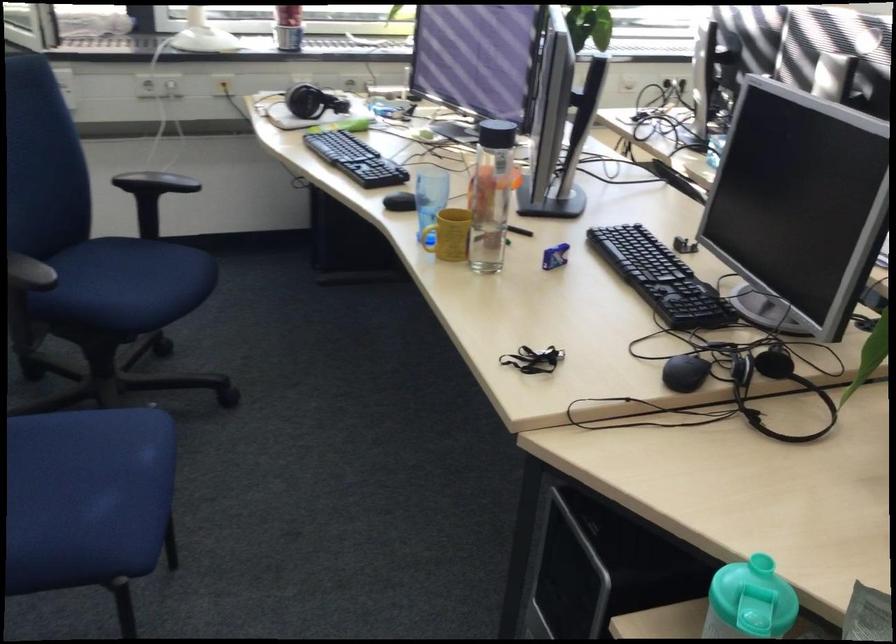
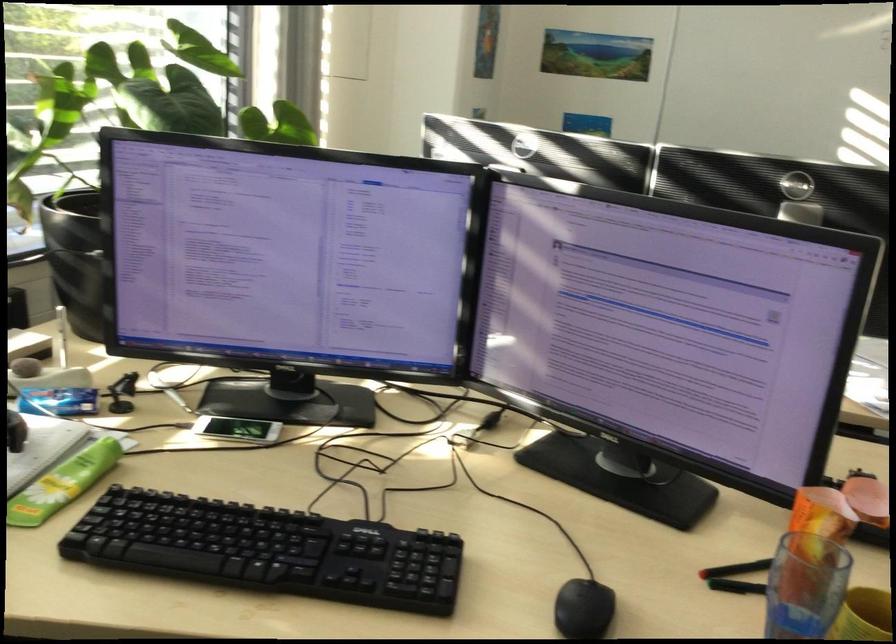
In the second image, find the point that corresponds to pixel 555 87 in the first image.

(826, 328)